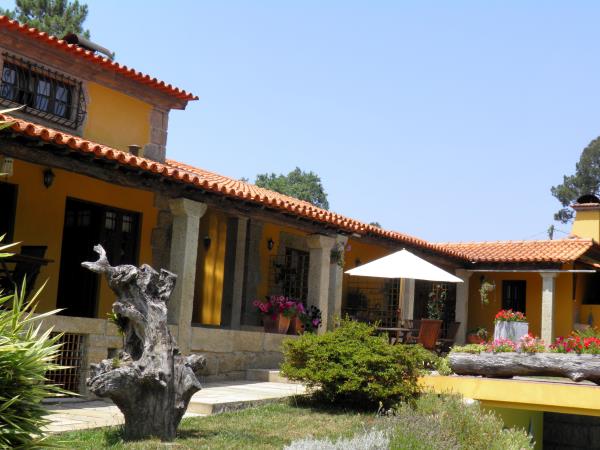
At what (x,y) coordinates should I click in order to perform the action: click on plant holder. Please return your answer as a coordinate pair (x, y). Looking at the image, I should click on (515, 330).